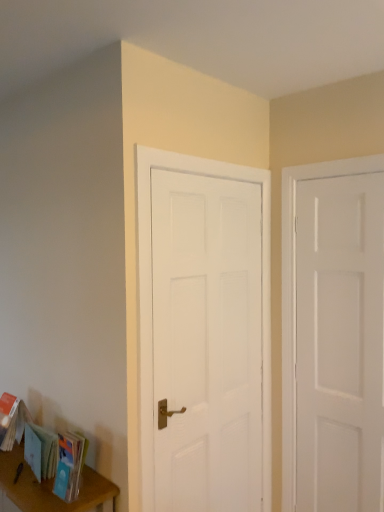
Image resolution: width=384 pixels, height=512 pixels. I want to click on space that is in front of light blue paper book at lower left, so click(31, 490).